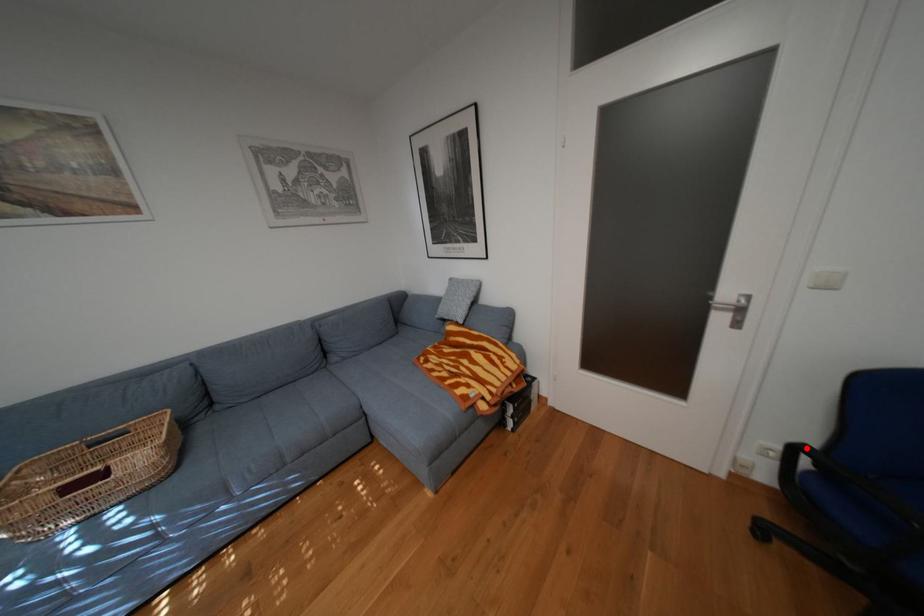
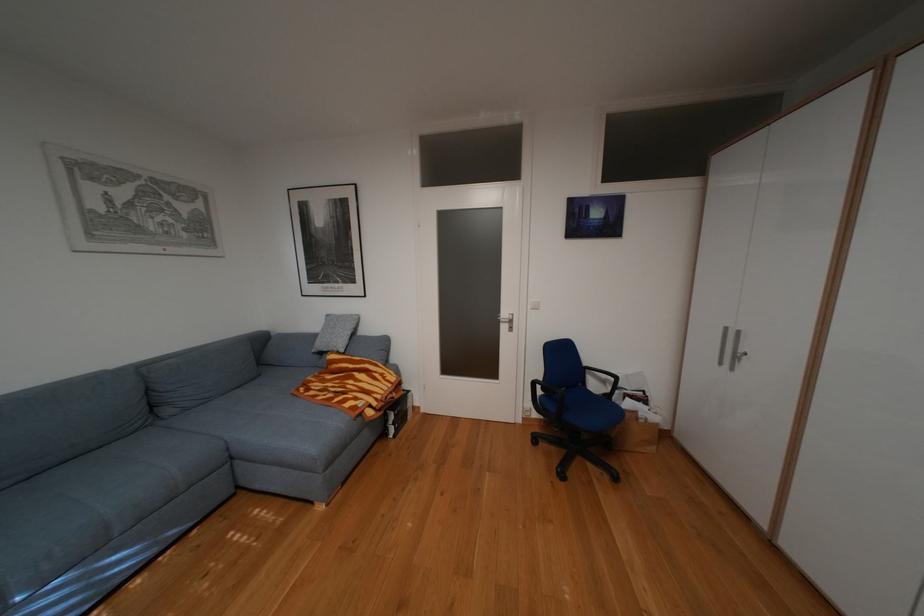
The point at the highlighted location is marked in the first image. Where is the corresponding point in the second image?

(545, 383)